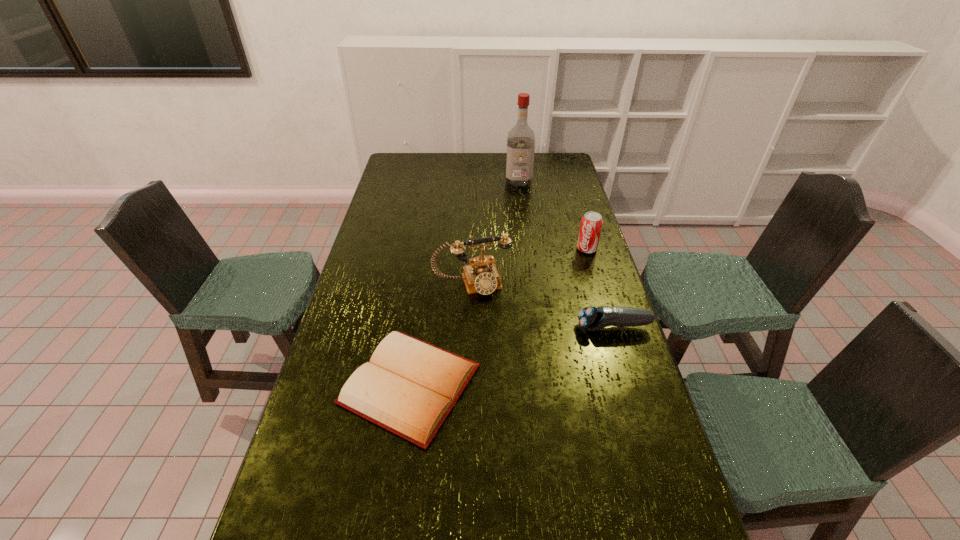
You are a GUI agent. You are given a task and a screenshot of the screen. Output one action in this format:
    pyautogui.click(x=<x>, y=<y>)
    Task: Click on the vacant space positioned 0.380m on the front-facing side of the liquor
    
    Given the screenshot: What is the action you would take?
    pyautogui.click(x=520, y=235)

Where is `object located in the left edge section of the desktop`? Image resolution: width=960 pixels, height=540 pixels. object located in the left edge section of the desktop is located at coordinates (409, 387).

At what (x,y) coordinates should I click in order to perform the action: click on electric shaver located at the right edge. Please return your answer as a coordinate pair (x, y). Looking at the image, I should click on (591, 318).

This screenshot has height=540, width=960. Find the location of `soda can present at the right edge`. soda can present at the right edge is located at coordinates (591, 223).

Locate an element on the screen. Image resolution: width=960 pixels, height=540 pixels. blank space at the far edge of the desktop is located at coordinates (536, 170).

Identify the location of free region at the near edge of the desktop. (461, 517).

Image resolution: width=960 pixels, height=540 pixels. In the image, there is a desktop. In order to click on free space at the left edge in this screenshot , I will do `click(356, 262)`.

Image resolution: width=960 pixels, height=540 pixels. In the image, there is a desktop. Identify the location of vacant space at the right edge. (562, 220).

This screenshot has width=960, height=540. In the image, there is a desktop. Identify the location of free region at the far left corner. (408, 156).

Image resolution: width=960 pixels, height=540 pixels. I want to click on vacant point located between the telephone and the Bible, so click(x=441, y=334).